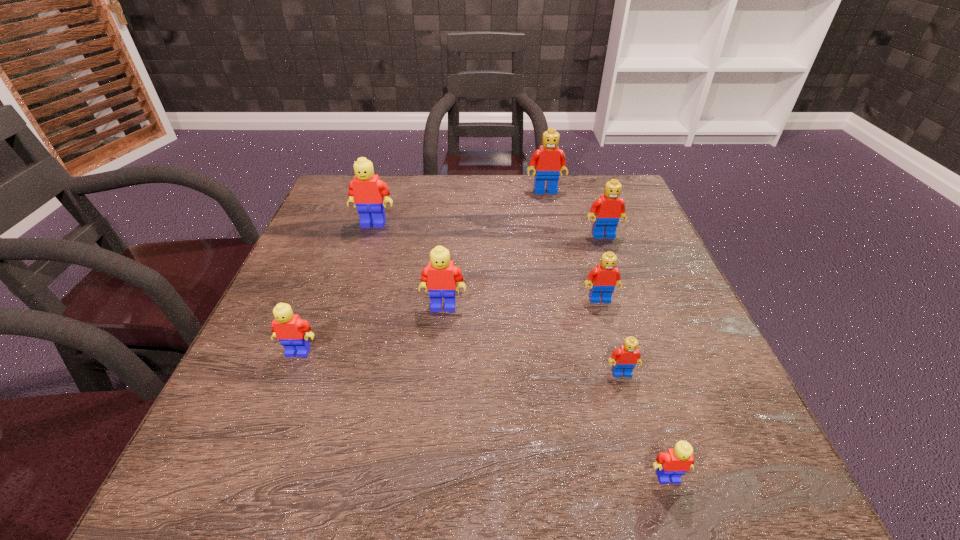
Locate an element on the screen. free spot between the second yellow Lego from right to left and the third nearest object is located at coordinates click(x=371, y=329).

This screenshot has width=960, height=540. I want to click on free space between the sixth Lego from right to left and the farthest Lego, so click(x=494, y=248).

You are a GUI agent. You are given a task and a screenshot of the screen. Output one action in this format:
    pyautogui.click(x=<x>, y=<y>)
    Task: Click on the unoccupied area between the farthest red Lego and the sixth nearest Lego
    The image size is (960, 540).
    Given the screenshot: What is the action you would take?
    pyautogui.click(x=574, y=213)

Where is `unoccupied position between the biggest red Lego and the third farthest object`? This screenshot has width=960, height=540. unoccupied position between the biggest red Lego and the third farthest object is located at coordinates (574, 213).

I want to click on blank region between the third object from left to right and the third farthest Lego, so pos(523,271).

Locate an element on the screen. This screenshot has width=960, height=540. free spot between the nearest yellow Lego and the third Lego from left to right is located at coordinates (556, 392).

You are a GUI agent. You are given a task and a screenshot of the screen. Output one action in this format:
    pyautogui.click(x=<x>, y=<y>)
    Task: Click on the free point between the second biggest red Lego and the seventh nearest object
    The width and height of the screenshot is (960, 540).
    Given the screenshot: What is the action you would take?
    pyautogui.click(x=489, y=229)

Where is `free space between the sixth object from right to left and the third farthest red Lego`? free space between the sixth object from right to left and the third farthest red Lego is located at coordinates (521, 302).

Identify the location of object that is the closest to the second smallest yellow Lego. The width and height of the screenshot is (960, 540). (441, 275).

Identify which object is located as the fifth nearest to the nearest Lego. Please provide its 2D coordinates. Your answer should be formatted as a tuple, i.e. [(x, y)], where the tuple contains the x and y coordinates of a point satisfying the conditions above.

[(292, 332)]